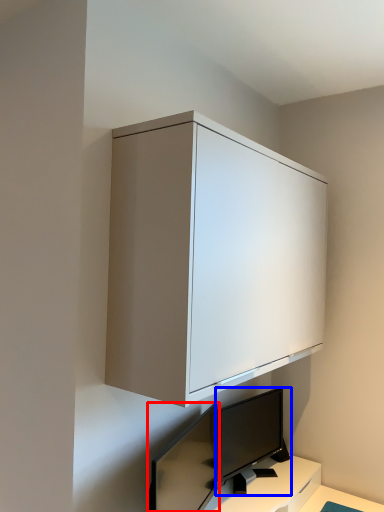
Question: Which of the following is the closest to the observer, computer monitor (highlighted by a red box) or computer monitor (highlighted by a blue box)?

Choices:
 (A) computer monitor
 (B) computer monitor

Answer: (A)